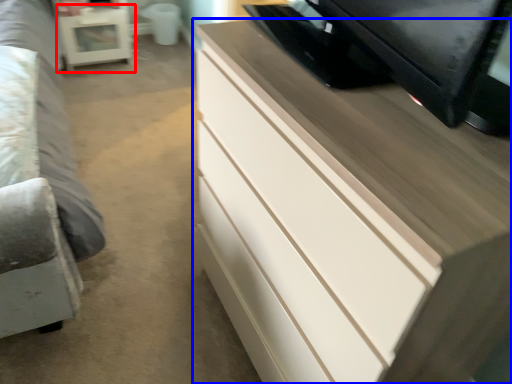
Question: Which of the following is the farthest to the observer, table (highlighted by a red box) or chest of drawers (highlighted by a blue box)?

Choices:
 (A) table
 (B) chest of drawers

Answer: (A)